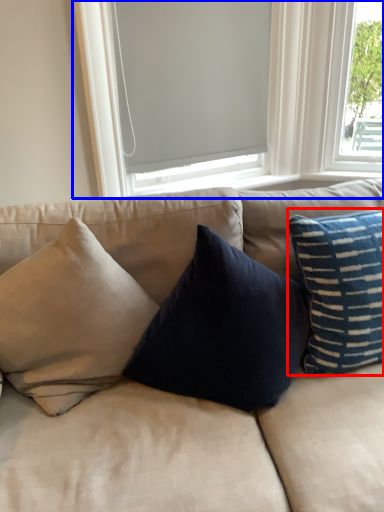
Question: Which point is closer to the camera, pillow (highlighted by a red box) or window (highlighted by a blue box)?

Choices:
 (A) pillow
 (B) window

Answer: (A)